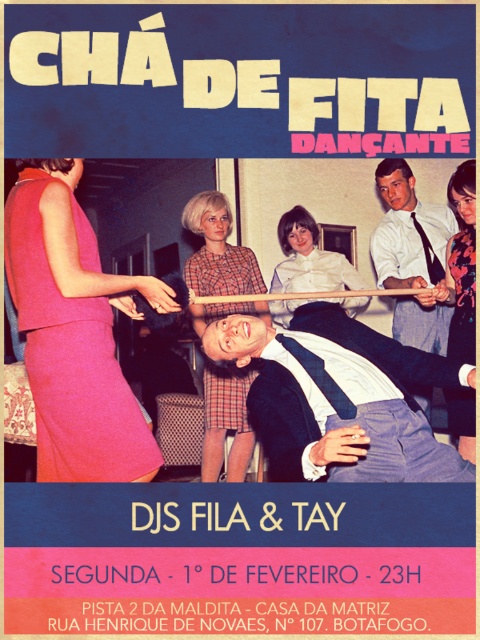
Question: Which object is positioned farthest from the matte pink dress at left?

Choices:
 (A) white shirt at center
 (B) white satin blouse at center
 (C) dark blue suit at center

Answer: (B)

Question: Does dark blue suit at center appear on the left side of plaid fabric skirt at center?

Choices:
 (A) yes
 (B) no

Answer: (B)

Question: Can you confirm if matte pink dress at left is positioned below white satin blouse at center?

Choices:
 (A) yes
 (B) no

Answer: (A)

Question: Does dark blue suit at center have a smaller size compared to white shirt at center?

Choices:
 (A) yes
 (B) no

Answer: (B)

Question: Among these objects, which one is nearest to the camera?

Choices:
 (A) white shirt at center
 (B) white satin blouse at center
 (C) matte pink dress at left

Answer: (C)

Question: Which object is positioned farthest from the dark blue suit at center?

Choices:
 (A) white shirt at center
 (B) matte pink dress at left
 (C) plaid fabric skirt at center
 (D) floral print blouse at upper right

Answer: (C)